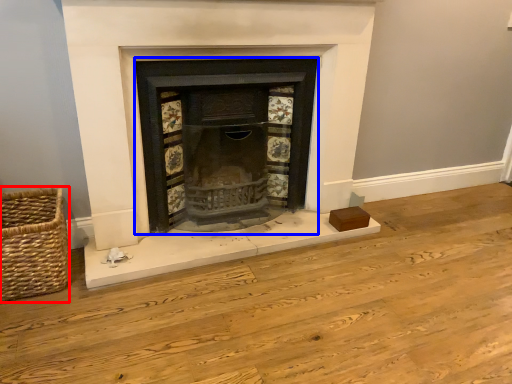
Question: Which object is closer to the camera taking this photo, basket (highlighted by a red box) or wood burning stove (highlighted by a blue box)?

Choices:
 (A) basket
 (B) wood burning stove

Answer: (A)